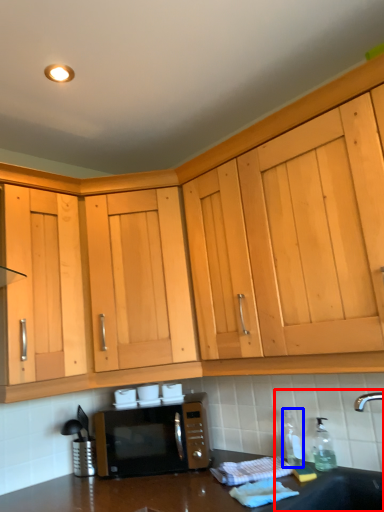
Question: Which of the following is the closest to the observer, sink (highlighted by a red box) or bottle (highlighted by a blue box)?

Choices:
 (A) sink
 (B) bottle

Answer: (A)